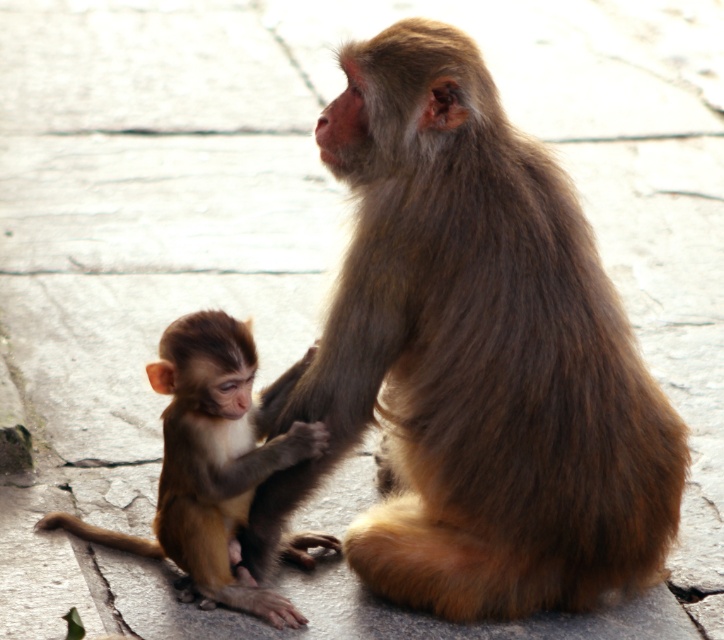
Between brown furry monkey at center and brown furry monkey at lower left, which one is positioned lower?

brown furry monkey at lower left is lower down.

Is point (382, 460) closer to viewer compared to point (85, 528)?

No, (382, 460) is behind (85, 528).

Locate an element on the screen. This screenshot has height=640, width=724. brown furry monkey at center is located at coordinates (473, 356).